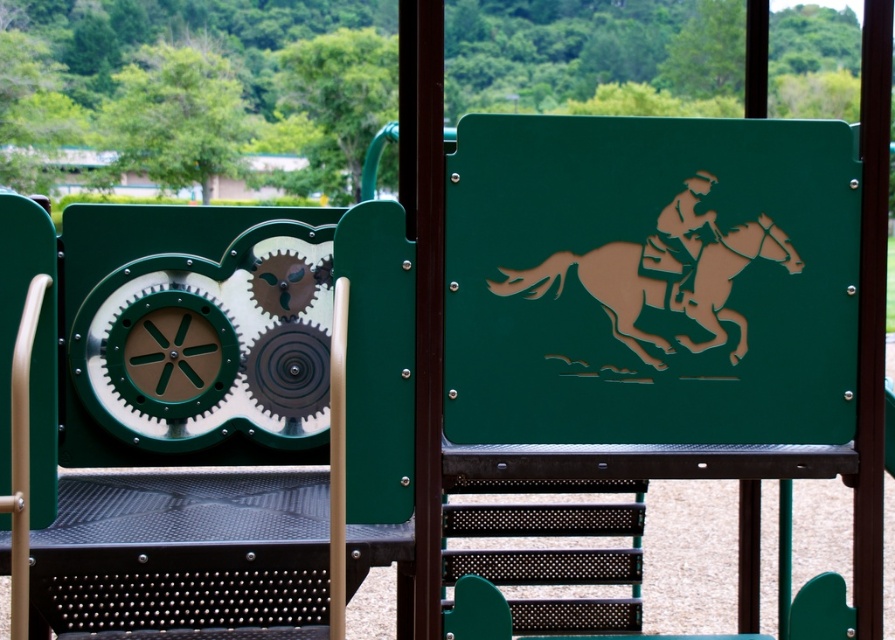
Who is positioned more to the right, brown laser-cut horse at center or brown matte/jet black at upper right?

brown matte/jet black at upper right

Between brown laser-cut horse at center and brown matte/jet black at upper right, which one appears on the left side from the viewer's perspective?

Positioned to the left is brown laser-cut horse at center.

Does point (619, 317) come farther from viewer compared to point (678, 212)?

No, it is in front of (678, 212).

Find the location of a particular element. The height and width of the screenshot is (640, 895). brown laser-cut horse at center is located at coordinates (663, 276).